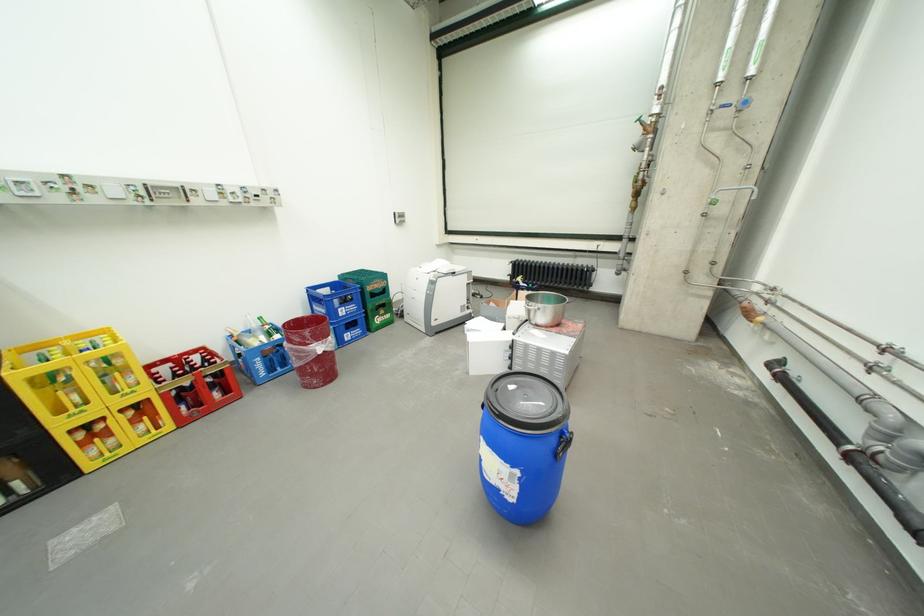
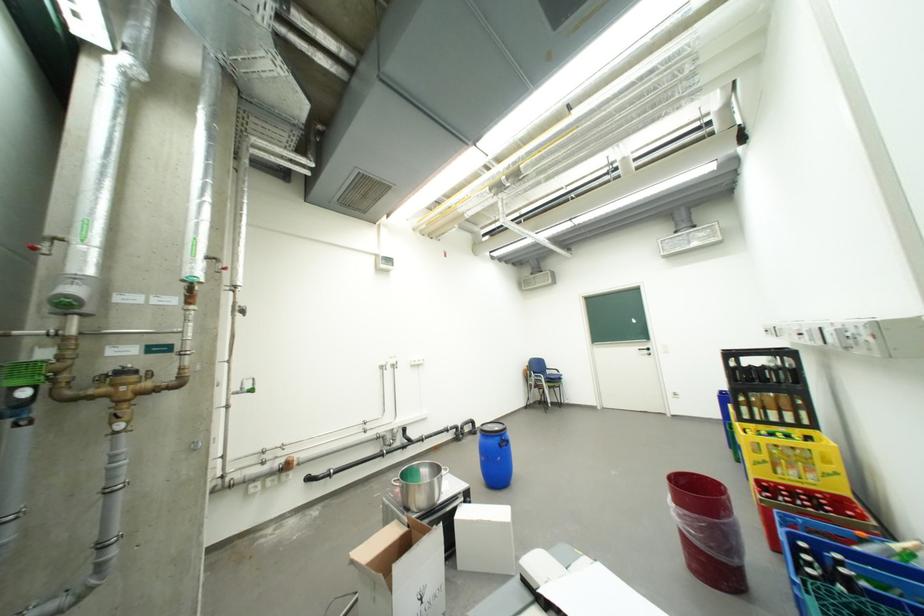
Find the pixel in the second image that matches [339,339] in the first image.

(685, 507)